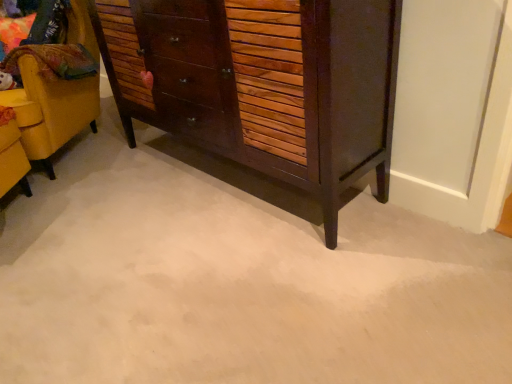
The height and width of the screenshot is (384, 512). Describe the element at coordinates (55, 91) in the screenshot. I see `wooden cabinet at right` at that location.

Locate an element on the screen. The width and height of the screenshot is (512, 384). wooden cabinet at right is located at coordinates (55, 91).

Locate an element on the screen. dark brown wood chest of drawers at center is located at coordinates (263, 83).

Image resolution: width=512 pixels, height=384 pixels. Describe the element at coordinates (263, 83) in the screenshot. I see `dark brown wood chest of drawers at center` at that location.

The width and height of the screenshot is (512, 384). Find the location of `wooden cabinet at right`. wooden cabinet at right is located at coordinates (55, 91).

Is wooden cabinet at right to the left or to the right of dark brown wood chest of drawers at center in the image?

From the image, it's evident that wooden cabinet at right is to the left of dark brown wood chest of drawers at center.

Is wooden cabinet at right in front of dark brown wood chest of drawers at center?

That is False.

Is point (84, 122) closer or farther from the camera than point (286, 70)?

Clearly, point (84, 122) is more distant from the camera than point (286, 70).

From the image's perspective, is wooden cabinet at right above or below dark brown wood chest of drawers at center?

Based on their image positions, wooden cabinet at right is located above dark brown wood chest of drawers at center.

From a real-world perspective, does wooden cabinet at right sit lower than dark brown wood chest of drawers at center?

Correct, in the physical world, wooden cabinet at right is lower than dark brown wood chest of drawers at center.

Considering the sizes of objects wooden cabinet at right and dark brown wood chest of drawers at center in the image provided, who is thinner, wooden cabinet at right or dark brown wood chest of drawers at center?

dark brown wood chest of drawers at center.

Is wooden cabinet at right taller or shorter than dark brown wood chest of drawers at center?

Clearly, wooden cabinet at right is taller compared to dark brown wood chest of drawers at center.

Considering the sizes of wooden cabinet at right and dark brown wood chest of drawers at center in the image, is wooden cabinet at right bigger or smaller than dark brown wood chest of drawers at center?

Clearly, wooden cabinet at right is larger in size than dark brown wood chest of drawers at center.

Is wooden cabinet at right situated inside dark brown wood chest of drawers at center or outside?

The correct answer is: outside.

Based on the photo, is wooden cabinet at right next to dark brown wood chest of drawers at center and touching it?

wooden cabinet at right and dark brown wood chest of drawers at center are not in contact.

Is wooden cabinet at right aimed at dark brown wood chest of drawers at center?

No, wooden cabinet at right is not turned towards dark brown wood chest of drawers at center.

How different are the orientations of wooden cabinet at right and dark brown wood chest of drawers at center in degrees?

35.2 degrees.

Locate an element on the screen. Image resolution: width=512 pixels, height=384 pixels. furniture that is on the left side of dark brown wood chest of drawers at center is located at coordinates (55, 91).

Would you say dark brown wood chest of drawers at center is to the left or to the right of wooden cabinet at right in the picture?

From the image, it's evident that dark brown wood chest of drawers at center is to the right of wooden cabinet at right.

Considering the positions of objects dark brown wood chest of drawers at center and wooden cabinet at right in the image provided, who is in front, dark brown wood chest of drawers at center or wooden cabinet at right?

dark brown wood chest of drawers at center is closer to the camera.

Which is behind, point (303, 68) or point (46, 115)?

Point (46, 115)

Looking at this image, from the image's perspective, which is above, dark brown wood chest of drawers at center or wooden cabinet at right?

wooden cabinet at right appears higher in the image.

From a real-world perspective, is dark brown wood chest of drawers at center physically located above or below wooden cabinet at right?

From a real-world perspective, dark brown wood chest of drawers at center is physically above wooden cabinet at right.

Looking at their sizes, would you say dark brown wood chest of drawers at center is wider or thinner than wooden cabinet at right?

Considering their sizes, dark brown wood chest of drawers at center looks slimmer than wooden cabinet at right.

In terms of height, does dark brown wood chest of drawers at center look taller or shorter compared to wooden cabinet at right?

Clearly, dark brown wood chest of drawers at center is shorter compared to wooden cabinet at right.

Can you confirm if dark brown wood chest of drawers at center is bigger than wooden cabinet at right?

No, dark brown wood chest of drawers at center is not bigger than wooden cabinet at right.

Is dark brown wood chest of drawers at center not within wooden cabinet at right?

That's correct, dark brown wood chest of drawers at center is outside of wooden cabinet at right.

In the scene shown: Is dark brown wood chest of drawers at center beside wooden cabinet at right?

No, dark brown wood chest of drawers at center is not making contact with wooden cabinet at right.

Could you tell me if dark brown wood chest of drawers at center is turned towards wooden cabinet at right?

No, dark brown wood chest of drawers at center does not turn towards wooden cabinet at right.

What's the angular difference between dark brown wood chest of drawers at center and wooden cabinet at right's facing directions?

The angle between the facing direction of dark brown wood chest of drawers at center and the facing direction of wooden cabinet at right is 35.2 degrees.

Find the location of `furniture above the dark brown wood chest of drawers at center (from the image's perspective)`. furniture above the dark brown wood chest of drawers at center (from the image's perspective) is located at coordinates (55, 91).

In the image, there is a dark brown wood chest of drawers at center. Identify the location of furniture below it (from a real-world perspective). This screenshot has height=384, width=512. (55, 91).

You are a GUI agent. You are given a task and a screenshot of the screen. Output one action in this format:
    pyautogui.click(x=<x>, y=<y>)
    Task: Click on the furniture on the left side of dark brown wood chest of drawers at center
    The height and width of the screenshot is (384, 512).
    Given the screenshot: What is the action you would take?
    pyautogui.click(x=55, y=91)